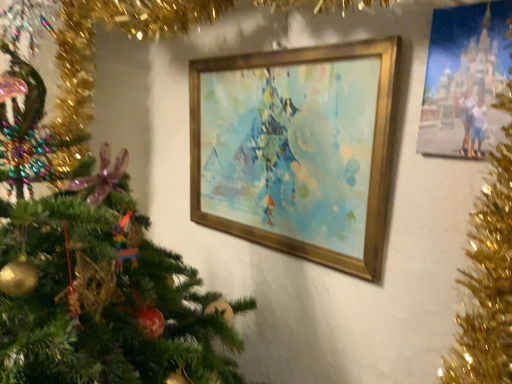
What is the approximate width of gold metallic picture frame at center, the second picture frame positioned from the right?

The width of gold metallic picture frame at center, the second picture frame positioned from the right, is 6.62 centimeters.

Locate an element on the screen. The width and height of the screenshot is (512, 384). gold metallic picture frame at center, the second picture frame positioned from the right is located at coordinates (296, 150).

Describe the element at coordinates (296, 150) in the screenshot. I see `gold metallic picture frame at center, the 2th picture frame positioned from the front` at that location.

Describe the element at coordinates (464, 79) in the screenshot. I see `matte plastic photo frame at upper right, which appears as the 2th picture frame when viewed from the back` at that location.

Identify the location of matte plastic photo frame at upper right, the second picture frame in the left-to-right sequence. The image size is (512, 384). (464, 79).

The width and height of the screenshot is (512, 384). Identify the location of gold metallic picture frame at center, which is the 1th picture frame from left to right. (296, 150).

Does gold metallic picture frame at center, the 2th picture frame positioned from the front, appear on the right side of matte plastic photo frame at upper right, the second picture frame in the left-to-right sequence?

No, gold metallic picture frame at center, the 2th picture frame positioned from the front, is not to the right of matte plastic photo frame at upper right, the second picture frame in the left-to-right sequence.

In the image, is gold metallic picture frame at center, the 2th picture frame positioned from the front, positioned in front of or behind matte plastic photo frame at upper right, the second picture frame in the left-to-right sequence?

gold metallic picture frame at center, the 2th picture frame positioned from the front, is behind matte plastic photo frame at upper right, the second picture frame in the left-to-right sequence.

Is point (370, 42) positioned behind point (467, 8)?

Yes, point (370, 42) is farther from viewer.

In the scene shown: From the image's perspective, between gold metallic picture frame at center, which is the 1th picture frame from left to right, and matte plastic photo frame at upper right, acting as the 1th picture frame starting from the front, who is located below?

gold metallic picture frame at center, which is the 1th picture frame from left to right.

From a real-world perspective, which is physically below, gold metallic picture frame at center, the 2th picture frame positioned from the front, or matte plastic photo frame at upper right, which appears as the 2th picture frame when viewed from the back?

gold metallic picture frame at center, the 2th picture frame positioned from the front, from a real-world perspective.

Looking at their sizes, would you say gold metallic picture frame at center, which is the 1th picture frame from left to right, is wider or thinner than matte plastic photo frame at upper right, the 1th picture frame positioned from the right?

Clearly, gold metallic picture frame at center, which is the 1th picture frame from left to right, has more width compared to matte plastic photo frame at upper right, the 1th picture frame positioned from the right.

Between gold metallic picture frame at center, which is the first picture frame in back-to-front order, and matte plastic photo frame at upper right, acting as the 1th picture frame starting from the front, which one has more height?

gold metallic picture frame at center, which is the first picture frame in back-to-front order.

From the picture: Considering the relative sizes of gold metallic picture frame at center, the 2th picture frame positioned from the front, and matte plastic photo frame at upper right, the second picture frame in the left-to-right sequence, in the image provided, is gold metallic picture frame at center, the 2th picture frame positioned from the front, bigger than matte plastic photo frame at upper right, the second picture frame in the left-to-right sequence,?

Correct, gold metallic picture frame at center, the 2th picture frame positioned from the front, is larger in size than matte plastic photo frame at upper right, the second picture frame in the left-to-right sequence.

Is matte plastic photo frame at upper right, the 1th picture frame positioned from the right, surrounded by gold metallic picture frame at center, the second picture frame positioned from the right?

No, matte plastic photo frame at upper right, the 1th picture frame positioned from the right, is not inside gold metallic picture frame at center, the second picture frame positioned from the right.

Are gold metallic picture frame at center, which is the first picture frame in back-to-front order, and matte plastic photo frame at upper right, acting as the 1th picture frame starting from the front, far apart?

No, gold metallic picture frame at center, which is the first picture frame in back-to-front order, is not far away from matte plastic photo frame at upper right, acting as the 1th picture frame starting from the front.

From the picture: Is gold metallic picture frame at center, the 2th picture frame positioned from the front, oriented away from matte plastic photo frame at upper right, acting as the 1th picture frame starting from the front?

No, gold metallic picture frame at center, the 2th picture frame positioned from the front, is not facing the opposite direction of matte plastic photo frame at upper right, acting as the 1th picture frame starting from the front.

How different are the orientations of gold metallic picture frame at center, which is the 1th picture frame from left to right, and matte plastic photo frame at upper right, acting as the 1th picture frame starting from the front, in degrees?

They differ by 0.57 degrees in their facing directions.

Where is `picture frame that appears behind the matte plastic photo frame at upper right, the second picture frame in the left-to-right sequence`? Image resolution: width=512 pixels, height=384 pixels. picture frame that appears behind the matte plastic photo frame at upper right, the second picture frame in the left-to-right sequence is located at coordinates (296, 150).

Considering the positions of objects matte plastic photo frame at upper right, the second picture frame in the left-to-right sequence, and gold metallic picture frame at center, the 2th picture frame positioned from the front, in the image provided, who is more to the right, matte plastic photo frame at upper right, the second picture frame in the left-to-right sequence, or gold metallic picture frame at center, the 2th picture frame positioned from the front,?

Positioned to the right is matte plastic photo frame at upper right, the second picture frame in the left-to-right sequence.

Which is in front, matte plastic photo frame at upper right, the second picture frame in the left-to-right sequence, or gold metallic picture frame at center, the 2th picture frame positioned from the front?

matte plastic photo frame at upper right, the second picture frame in the left-to-right sequence.

Which point is more distant from viewer, (484, 143) or (195, 169)?

Point (195, 169)

From the image's perspective, which one is positioned lower, matte plastic photo frame at upper right, acting as the 1th picture frame starting from the front, or gold metallic picture frame at center, which is the 1th picture frame from left to right?

gold metallic picture frame at center, which is the 1th picture frame from left to right, appears lower in the image.

From a real-world perspective, is matte plastic photo frame at upper right, the 1th picture frame positioned from the right, above or below gold metallic picture frame at center, the second picture frame positioned from the right?

In terms of real-world spatial position, matte plastic photo frame at upper right, the 1th picture frame positioned from the right, is above gold metallic picture frame at center, the second picture frame positioned from the right.

Considering the sizes of matte plastic photo frame at upper right, the second picture frame in the left-to-right sequence, and gold metallic picture frame at center, which is the first picture frame in back-to-front order, in the image, is matte plastic photo frame at upper right, the second picture frame in the left-to-right sequence, wider or thinner than gold metallic picture frame at center, which is the first picture frame in back-to-front order,?

In the image, matte plastic photo frame at upper right, the second picture frame in the left-to-right sequence, appears to be more narrow than gold metallic picture frame at center, which is the first picture frame in back-to-front order.

From their relative heights in the image, would you say matte plastic photo frame at upper right, the second picture frame in the left-to-right sequence, is taller or shorter than gold metallic picture frame at center, the 2th picture frame positioned from the front?

matte plastic photo frame at upper right, the second picture frame in the left-to-right sequence, is shorter than gold metallic picture frame at center, the 2th picture frame positioned from the front.

Can you confirm if matte plastic photo frame at upper right, which appears as the 2th picture frame when viewed from the back, is smaller than gold metallic picture frame at center, the second picture frame positioned from the right?

Indeed, matte plastic photo frame at upper right, which appears as the 2th picture frame when viewed from the back, has a smaller size compared to gold metallic picture frame at center, the second picture frame positioned from the right.

Would you say gold metallic picture frame at center, which is the 1th picture frame from left to right, is part of matte plastic photo frame at upper right, which appears as the 2th picture frame when viewed from the back,'s contents?

No, gold metallic picture frame at center, which is the 1th picture frame from left to right, is not a part of matte plastic photo frame at upper right, which appears as the 2th picture frame when viewed from the back.

Is matte plastic photo frame at upper right, which appears as the 2th picture frame when viewed from the back, far away from gold metallic picture frame at center, the second picture frame positioned from the right?

That's not correct — matte plastic photo frame at upper right, which appears as the 2th picture frame when viewed from the back, is a little close to gold metallic picture frame at center, the second picture frame positioned from the right.

Is matte plastic photo frame at upper right, acting as the 1th picture frame starting from the front, facing away from gold metallic picture frame at center, which is the 1th picture frame from left to right?

matte plastic photo frame at upper right, acting as the 1th picture frame starting from the front, does not have its back to gold metallic picture frame at center, which is the 1th picture frame from left to right.

How different are the orientations of matte plastic photo frame at upper right, the second picture frame in the left-to-right sequence, and gold metallic picture frame at center, the 2th picture frame positioned from the front, in degrees?

The angle between the facing direction of matte plastic photo frame at upper right, the second picture frame in the left-to-right sequence, and the facing direction of gold metallic picture frame at center, the 2th picture frame positioned from the front, is 0.57 degrees.

At what (x,y) coordinates should I click in order to perform the action: click on picture frame below the matte plastic photo frame at upper right, acting as the 1th picture frame starting from the front (from a real-world perspective). Please return your answer as a coordinate pair (x, y). The width and height of the screenshot is (512, 384). Looking at the image, I should click on coord(296,150).

At what (x,y) coordinates should I click in order to perform the action: click on picture frame that appears on the right of gold metallic picture frame at center, the second picture frame positioned from the right. Please return your answer as a coordinate pair (x, y). This screenshot has height=384, width=512. Looking at the image, I should click on (464, 79).

This screenshot has height=384, width=512. I want to click on picture frame on the left of matte plastic photo frame at upper right, the 1th picture frame positioned from the right, so click(296, 150).